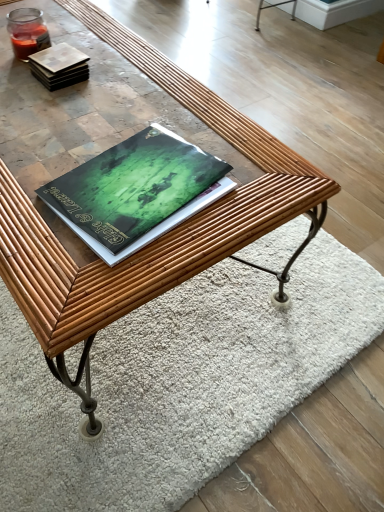
Where is `vacant location behind green matte book at center, the 2th book viewed from the top`? The image size is (384, 512). vacant location behind green matte book at center, the 2th book viewed from the top is located at coordinates (146, 111).